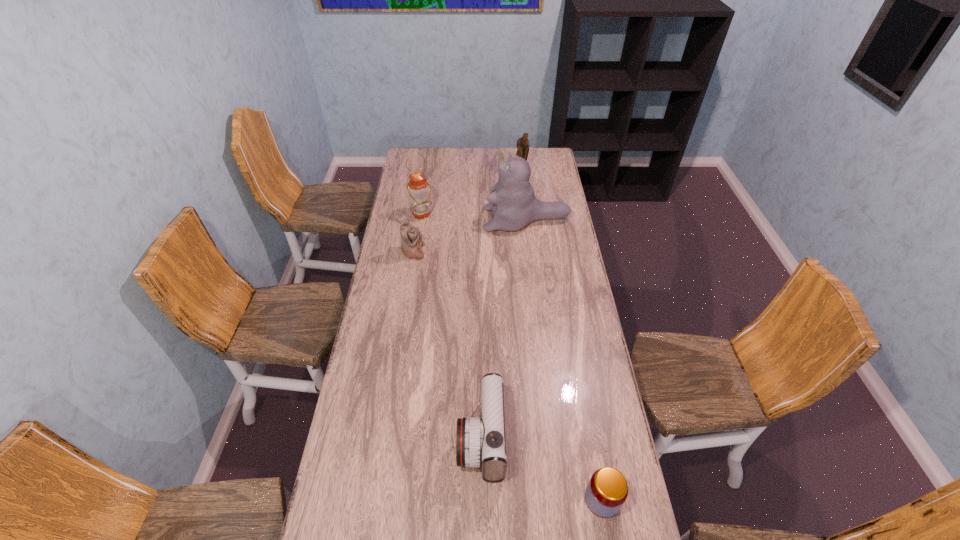
Where is `cat that is at the right edge`? cat that is at the right edge is located at coordinates click(x=514, y=205).

Image resolution: width=960 pixels, height=540 pixels. What are the coordinates of `jar that is at the right edge` in the screenshot? It's located at (607, 490).

Identify the location of vacant space at the left edge of the desktop. Image resolution: width=960 pixels, height=540 pixels. (385, 394).

You are a GUI agent. You are given a task and a screenshot of the screen. Output one action in this format:
    pyautogui.click(x=<x>, y=<y>)
    Task: Click on the vacant space at the right edge
    The image size is (960, 540).
    Given the screenshot: What is the action you would take?
    pyautogui.click(x=571, y=245)

Where is `blank region between the cat and the jar`? blank region between the cat and the jar is located at coordinates (564, 360).

Locate an element on the screen. vacant space that's between the right figurine and the oil lamp is located at coordinates (471, 193).

This screenshot has height=540, width=960. What are the coordinates of `vacant area that lies between the fifth tallest object and the oil lamp` in the screenshot? It's located at (451, 326).

Identify the location of free space between the cat and the second shortest object. (504, 329).

Image resolution: width=960 pixels, height=540 pixels. I want to click on free space between the oil lamp and the camcorder, so click(x=451, y=326).

In order to click on vacant point located between the shortest object and the fifth tallest object in this screenshot , I will do `click(541, 469)`.